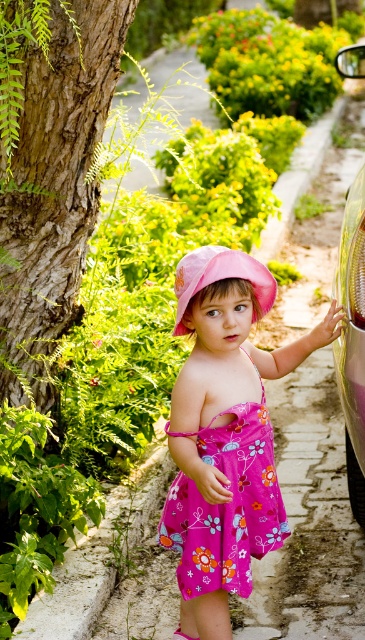
Can you confirm if pink floral dress at center is positioned above pink fabric hat at center?

Actually, pink floral dress at center is below pink fabric hat at center.

Image resolution: width=365 pixels, height=640 pixels. Describe the element at coordinates (224, 435) in the screenshot. I see `pink floral dress at center` at that location.

Is point (175, 506) behind point (258, 296)?

Yes, it is behind point (258, 296).

Where is `pink floral dress at center`? This screenshot has width=365, height=640. pink floral dress at center is located at coordinates (224, 435).

Is the position of pink floral dress at center more distant than that of shiny metallic car at right?

No.

Is pink floral dress at center above shiny metallic car at right?

No.

Is point (190, 636) less distant than point (355, 372)?

No, it is behind (355, 372).

Where is `pink floral dress at center`? pink floral dress at center is located at coordinates (224, 435).

Does point (271, 518) lie in front of point (363, 74)?

Yes, it is.

This screenshot has height=640, width=365. Describe the element at coordinates (225, 504) in the screenshot. I see `floral-patterned fabric dress at center` at that location.

Where is `floral-patterned fabric dress at center`? floral-patterned fabric dress at center is located at coordinates (225, 504).